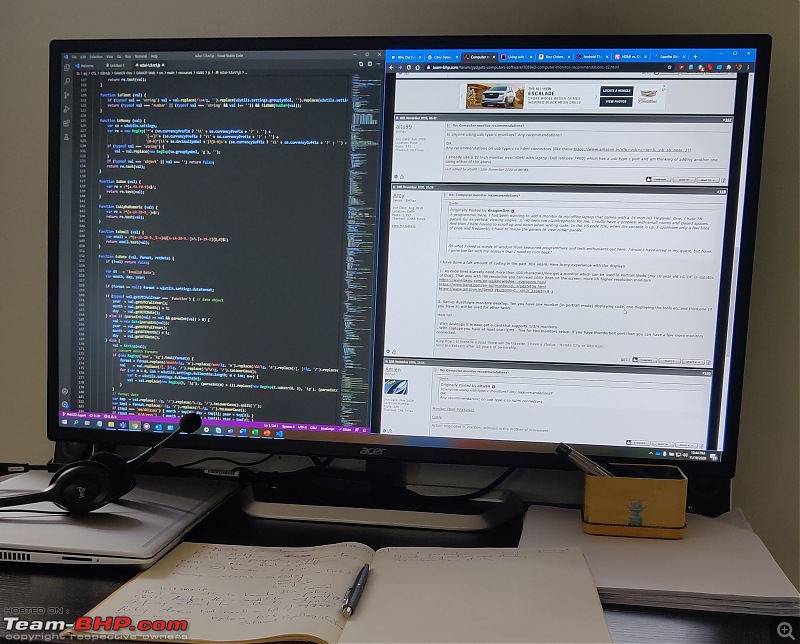
Image resolution: width=800 pixels, height=644 pixels. Identify the location of moniter stand. (370, 504).